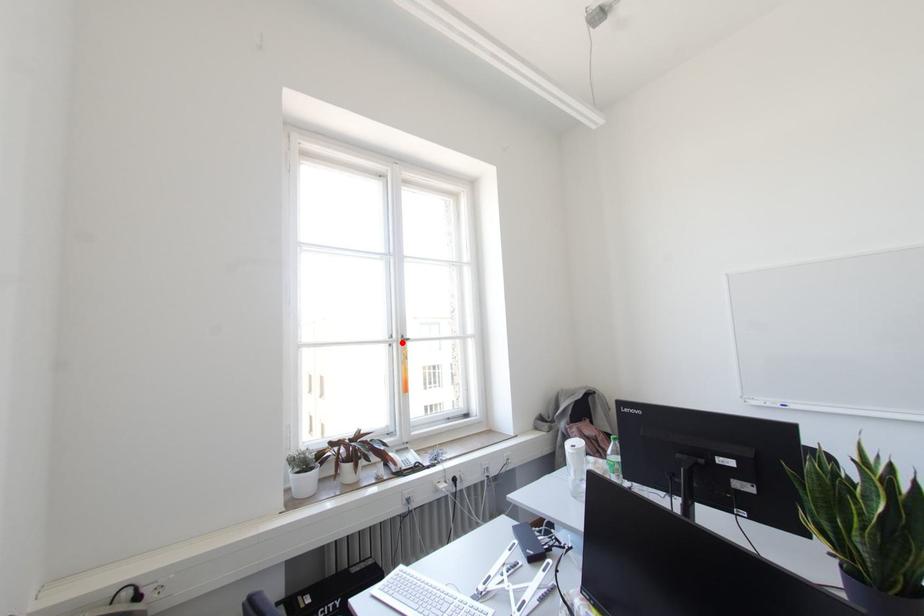
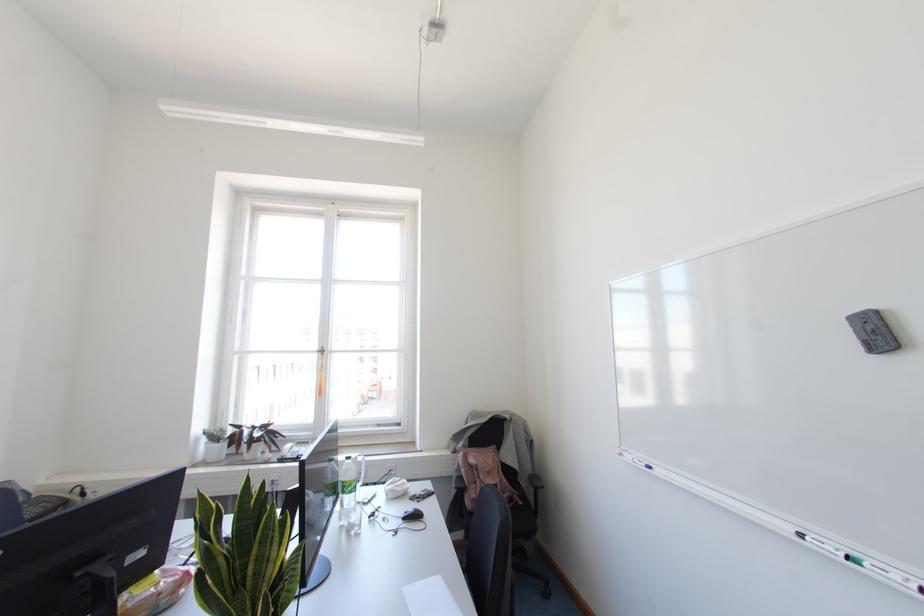
The point at the highlighted location is marked in the first image. Where is the corresponding point in the second image?

(322, 353)